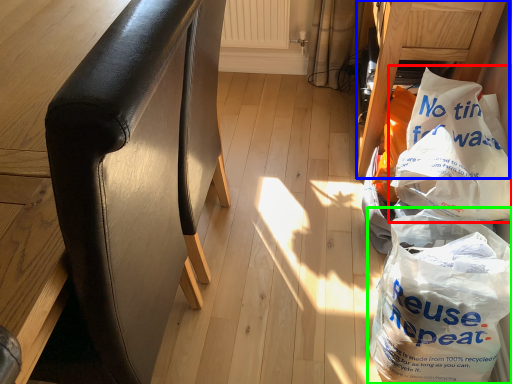
Question: Considering the real-world distances, which object is farthest from plastic bag (highlighted by a red box)? furniture (highlighted by a blue box) or plastic bag (highlighted by a green box)?

Choices:
 (A) furniture
 (B) plastic bag

Answer: (A)